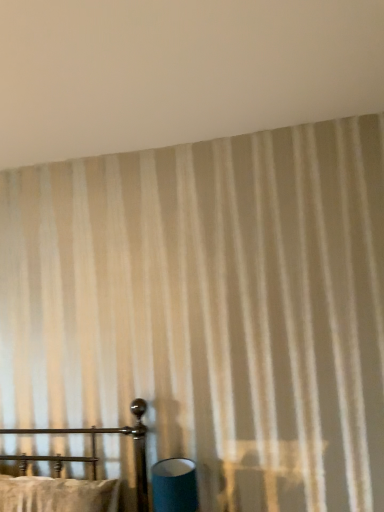
Question: Does metal bed frame at lower left have a greater height compared to beige striped curtain at upper center?

Choices:
 (A) no
 (B) yes

Answer: (B)

Question: Is metal bed frame at lower left outside of beige striped curtain at upper center?

Choices:
 (A) yes
 (B) no

Answer: (A)

Question: Is metal bed frame at lower left wider than beige striped curtain at upper center?

Choices:
 (A) no
 (B) yes

Answer: (A)

Question: Is metal bed frame at lower left further to the viewer compared to beige striped curtain at upper center?

Choices:
 (A) no
 (B) yes

Answer: (B)

Question: Would you consider metal bed frame at lower left to be distant from beige striped curtain at upper center?

Choices:
 (A) yes
 (B) no

Answer: (A)

Question: Can you confirm if metal bed frame at lower left is shorter than beige striped curtain at upper center?

Choices:
 (A) no
 (B) yes

Answer: (A)

Question: Is metal bed frame at lower left shorter than matte blue cylinder at lower center?

Choices:
 (A) no
 (B) yes

Answer: (A)

Question: From a real-world perspective, is metal bed frame at lower left on top of matte blue cylinder at lower center?

Choices:
 (A) yes
 (B) no

Answer: (A)

Question: Does metal bed frame at lower left come behind matte blue cylinder at lower center?

Choices:
 (A) yes
 (B) no

Answer: (B)

Question: From the image's perspective, does metal bed frame at lower left appear lower than matte blue cylinder at lower center?

Choices:
 (A) no
 (B) yes

Answer: (A)

Question: Is metal bed frame at lower left positioned with its back to matte blue cylinder at lower center?

Choices:
 (A) no
 (B) yes

Answer: (A)

Question: Would you say metal bed frame at lower left contains matte blue cylinder at lower center?

Choices:
 (A) yes
 (B) no

Answer: (B)

Question: From the image's perspective, is matte blue cylinder at lower center over beige striped curtain at upper center?

Choices:
 (A) no
 (B) yes

Answer: (A)